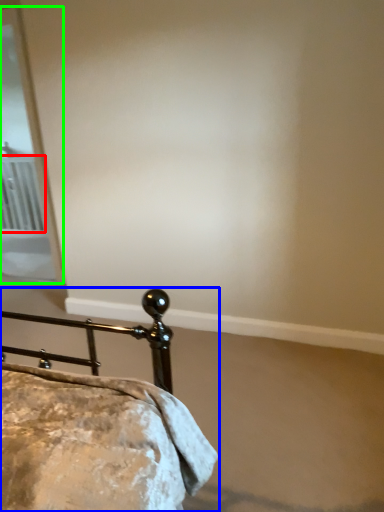
Question: Considering the real-world distances, which object is farthest from radiator (highlighted by a red box)? bed (highlighted by a blue box) or screen door (highlighted by a green box)?

Choices:
 (A) bed
 (B) screen door

Answer: (A)